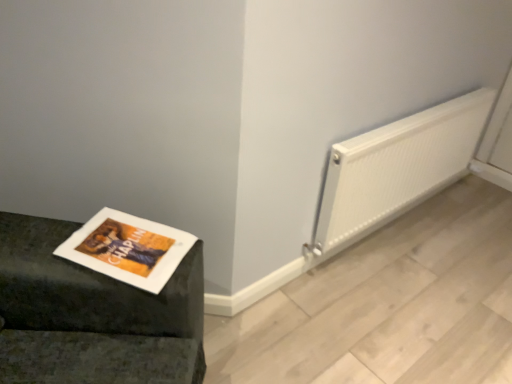
Locate an element on the screen. This screenshot has height=384, width=512. blank space above matte paper magazine at lower left (from a real-world perspective) is located at coordinates (124, 246).